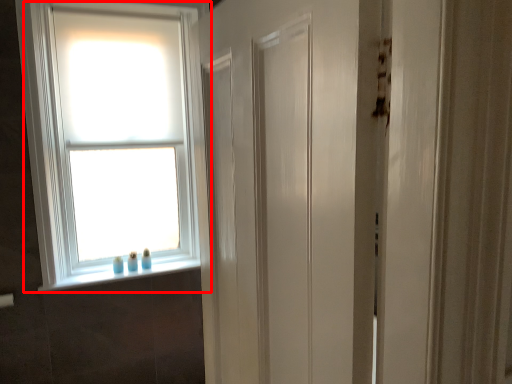
Question: In this image, where is window (annotated by the red box) located relative to window sill?

Choices:
 (A) left
 (B) right

Answer: (A)